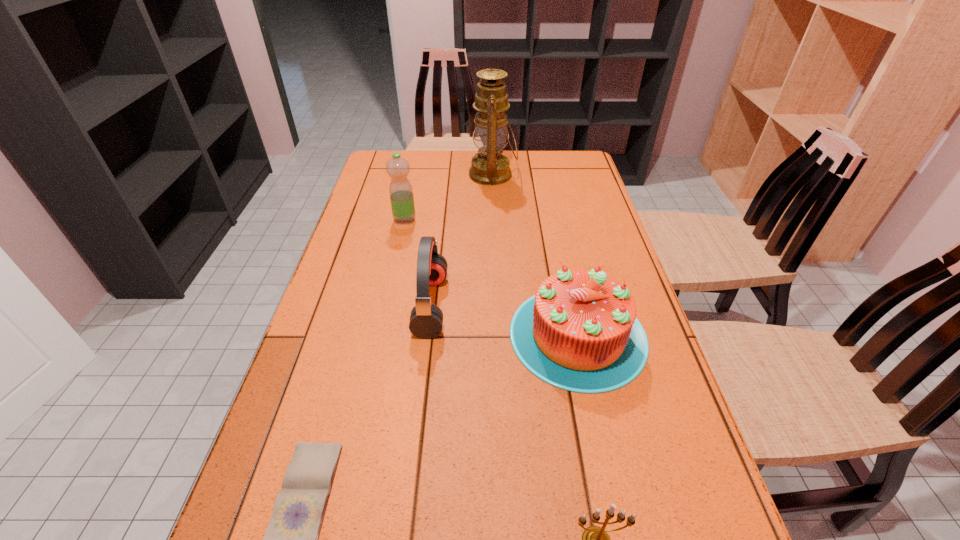
Find the location of `object located at the far edge`. object located at the far edge is located at coordinates (491, 167).

Where is `object positioned at the left edge`? Image resolution: width=960 pixels, height=540 pixels. object positioned at the left edge is located at coordinates (400, 189).

The image size is (960, 540). I want to click on object that is at the right edge, so click(579, 332).

In the image, there is a desktop. At what (x,y) coordinates should I click in order to perform the action: click on free space at the far edge. Please return your answer as a coordinate pair (x, y). This screenshot has width=960, height=540. Looking at the image, I should click on (466, 154).

Identify the location of free location at the left edge. Image resolution: width=960 pixels, height=540 pixels. coord(359,231).

Where is `vacant space at the right edge`? The image size is (960, 540). vacant space at the right edge is located at coordinates (584, 227).

This screenshot has height=540, width=960. Find the location of `empty space between the oil lamp and the cake`. empty space between the oil lamp and the cake is located at coordinates (536, 255).

Locate an element on the screen. free area in between the farthest object and the fifth shortest object is located at coordinates (448, 197).

Where is `free space between the cake and the fifth shortest object`? free space between the cake and the fifth shortest object is located at coordinates (492, 277).

At what (x,y) coordinates should I click in order to perform the action: click on object that is the third closest to the candelabrum. Please return your answer as a coordinate pair (x, y). Looking at the image, I should click on (426, 319).